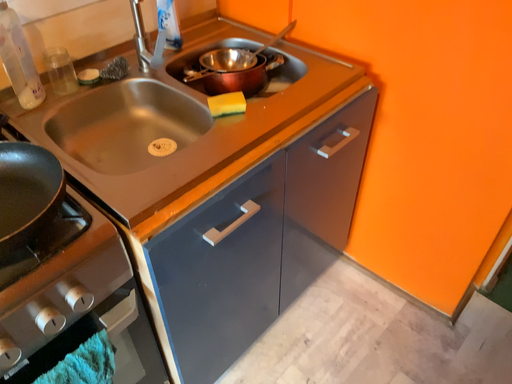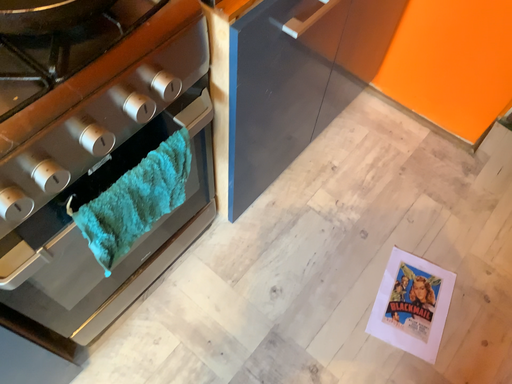
Question: Which way did the camera rotate in the video?

Choices:
 (A) rotated upward
 (B) rotated downward

Answer: (B)